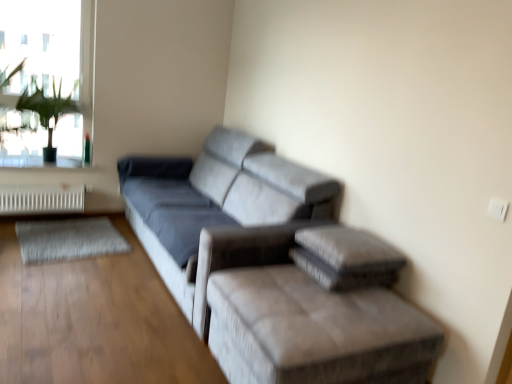
Question: Is white metallic radiator at lower left positioned in front of green leafy plant at upper left?

Choices:
 (A) no
 (B) yes

Answer: (A)

Question: From the image's perspective, is white metallic radiator at lower left on top of green leafy plant at upper left?

Choices:
 (A) no
 (B) yes

Answer: (A)

Question: Considering the relative sizes of white metallic radiator at lower left and green leafy plant at upper left in the image provided, is white metallic radiator at lower left thinner than green leafy plant at upper left?

Choices:
 (A) yes
 (B) no

Answer: (A)

Question: Would you say white metallic radiator at lower left contains green leafy plant at upper left?

Choices:
 (A) no
 (B) yes

Answer: (A)

Question: Can we say white metallic radiator at lower left lies outside green leafy plant at upper left?

Choices:
 (A) yes
 (B) no

Answer: (A)

Question: Considering the positions of point (68, 102) and point (244, 187), is point (68, 102) closer or farther from the camera than point (244, 187)?

Choices:
 (A) farther
 (B) closer

Answer: (A)

Question: From the image's perspective, is green leafy plant at upper left positioned above or below suede gray couch at center?

Choices:
 (A) above
 (B) below

Answer: (A)

Question: Is green leafy plant at upper left taller or shorter than suede gray couch at center?

Choices:
 (A) short
 (B) tall

Answer: (A)

Question: Is green leafy plant at upper left in front of or behind suede gray couch at center in the image?

Choices:
 (A) behind
 (B) front

Answer: (A)

Question: From a real-world perspective, is transparent glass window at upper left above or below suede gray couch at center?

Choices:
 (A) above
 (B) below

Answer: (A)

Question: Is transparent glass window at upper left wider or thinner than suede gray couch at center?

Choices:
 (A) wide
 (B) thin

Answer: (B)

Question: From the image's perspective, is transparent glass window at upper left positioned above or below suede gray couch at center?

Choices:
 (A) below
 (B) above

Answer: (B)

Question: Relative to suede gray couch at center, is transparent glass window at upper left in front or behind?

Choices:
 (A) front
 (B) behind

Answer: (B)

Question: From the image's perspective, is green leafy plant at upper left located above or below velvet gray ottoman at lower right?

Choices:
 (A) above
 (B) below

Answer: (A)

Question: Is green leafy plant at upper left situated inside velvet gray ottoman at lower right or outside?

Choices:
 (A) outside
 (B) inside

Answer: (A)